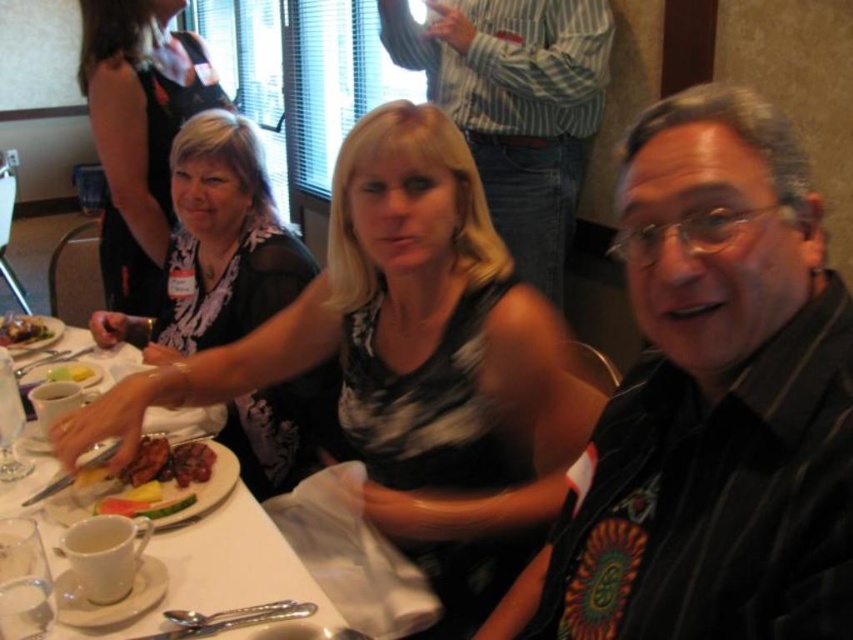
Based on the photo, can you confirm if black mesh dress at upper left is wider than brown glossy steak at center?

Yes, black mesh dress at upper left is wider than brown glossy steak at center.

Which is in front, point (115, 124) or point (7, 332)?

Point (7, 332)

Image resolution: width=853 pixels, height=640 pixels. In order to click on black mesh dress at upper left in this screenshot , I will do `click(138, 132)`.

Can you confirm if black striped shirt at right is smaller than brown glossy steak at center?

Answer: No, black striped shirt at right is not smaller than brown glossy steak at center.

What do you see at coordinates (711, 404) in the screenshot? This screenshot has height=640, width=853. I see `black striped shirt at right` at bounding box center [711, 404].

The width and height of the screenshot is (853, 640). I want to click on black striped shirt at right, so click(x=711, y=404).

Based on the photo, can you confirm if white glossy plate at center is shorter than yellow matte lemon at upper left?

In fact, white glossy plate at center may be taller than yellow matte lemon at upper left.

Is white glossy plate at center further to camera compared to yellow matte lemon at upper left?

That is False.

Between point (32, 472) and point (80, 365), which one is positioned behind?

The point (80, 365) is behind.

I want to click on white glossy plate at center, so click(222, 568).